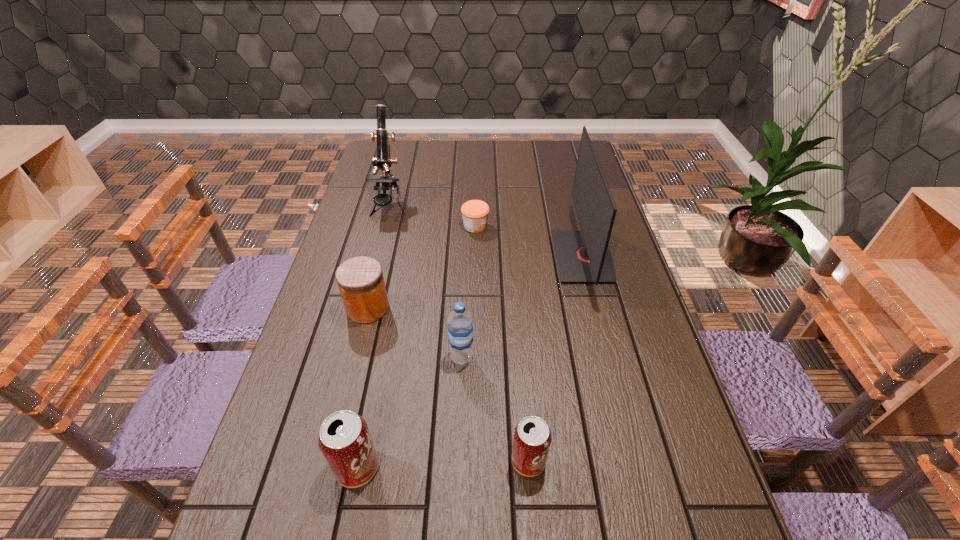
The image size is (960, 540). What are the coordinates of `the taller soda can` in the screenshot? It's located at point(345,441).

This screenshot has height=540, width=960. I want to click on the shorter soda can, so click(532, 437).

Where is `the second object from right to left`? Image resolution: width=960 pixels, height=540 pixels. the second object from right to left is located at coordinates (532, 437).

The height and width of the screenshot is (540, 960). I want to click on microscope, so click(x=383, y=161).

Image resolution: width=960 pixels, height=540 pixels. Find the location of `the shortest object`. the shortest object is located at coordinates (475, 213).

This screenshot has width=960, height=540. Identify the location of water bottle. (460, 325).

Locate an element on the screen. The height and width of the screenshot is (540, 960). jar is located at coordinates (360, 280).

Identify the location of the rightmost object. (583, 255).

The width and height of the screenshot is (960, 540). Identify the location of vacant space located on the right of the left soda can. tap(560, 468).

Where is `vacant space located on the right of the shorter soda can`? Image resolution: width=960 pixels, height=540 pixels. vacant space located on the right of the shorter soda can is located at coordinates (681, 461).